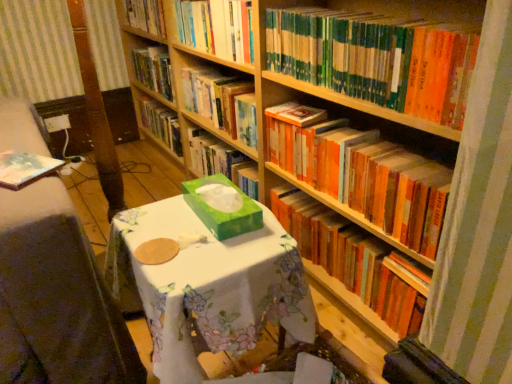
Find the location of a particular element. Image resolution: width=512 pixels, height=384 pixels. free point in front of green matte tissue box at center is located at coordinates (210, 256).